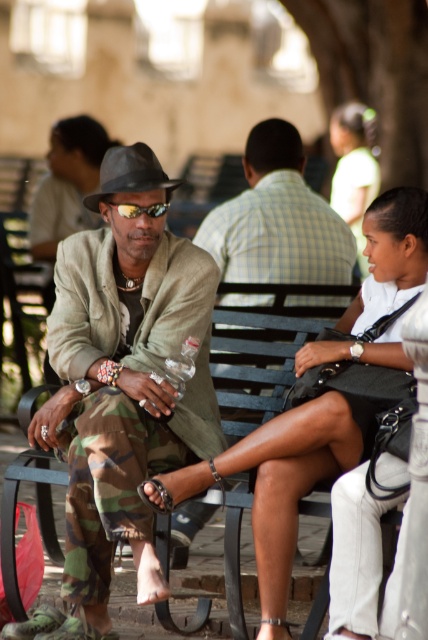
Does point (136, 220) come behind point (368, 109)?

No, it is not.

Does camouflage pants at center have a lesser height compared to matte black dress at center?

Yes, camouflage pants at center is shorter than matte black dress at center.

Where is `camouflage pants at center`? The width and height of the screenshot is (428, 640). camouflage pants at center is located at coordinates (121, 387).

Between point (128, 401) and point (294, 490), which one is positioned in front?

Point (294, 490) is in front.

Image resolution: width=428 pixels, height=640 pixels. Describe the element at coordinates (121, 387) in the screenshot. I see `camouflage pants at center` at that location.

What do you see at coordinates (121, 387) in the screenshot?
I see `camouflage pants at center` at bounding box center [121, 387].

Image resolution: width=428 pixels, height=640 pixels. I want to click on camouflage pants at center, so 121,387.

Based on the photo, does matte black bag at center have a lesser width compared to checkered fabric shirt at center?

Correct, matte black bag at center's width is less than checkered fabric shirt at center's.

Who is more distant from viewer, (275, 461) or (288, 304)?

Positioned behind is point (288, 304).

The width and height of the screenshot is (428, 640). I want to click on matte black bag at center, so click(276, 484).